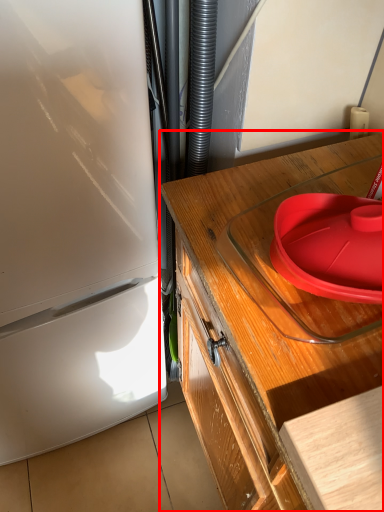
Question: From the image's perspective, what is the correct spatial relationship of countertop (annotated by the red box) in relation to plate?

Choices:
 (A) above
 (B) below

Answer: (B)